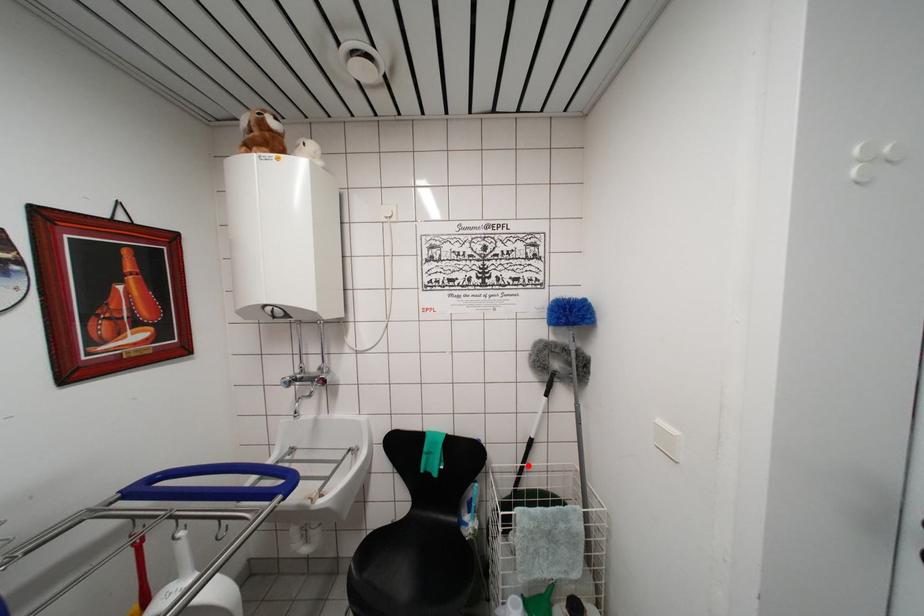
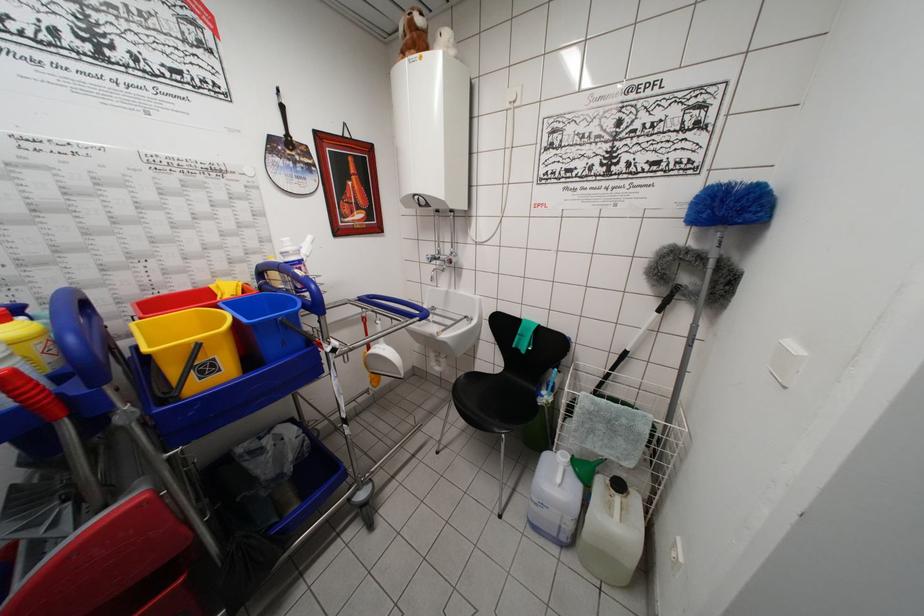
Where in the second image is the point corresponding to the highlighted location from the first image?

(616, 374)